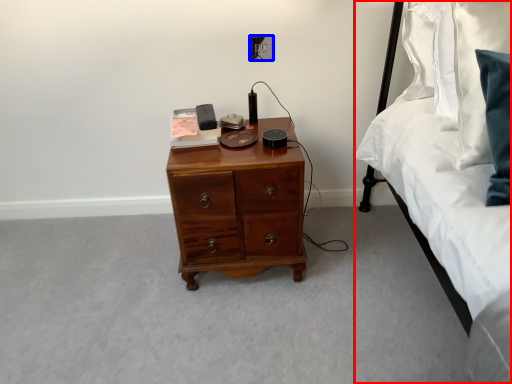
Question: Which object appears farthest to the camera in this image, bed (highlighted by a red box) or electric outlet (highlighted by a blue box)?

Choices:
 (A) bed
 (B) electric outlet

Answer: (B)